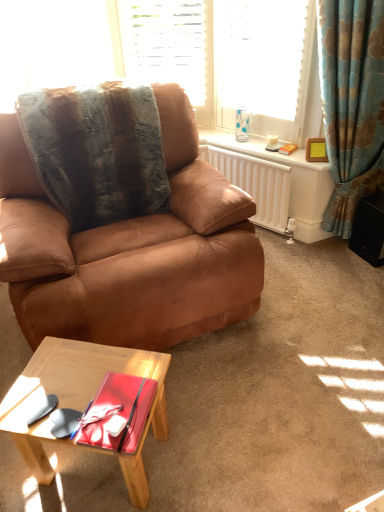
Question: Can you confirm if light wood coffee table at lower left is positioned to the right of fuzzy brown blanket at upper left?

Choices:
 (A) yes
 (B) no

Answer: (A)

Question: Considering the relative sizes of light wood coffee table at lower left and fuzzy brown blanket at upper left in the image provided, is light wood coffee table at lower left taller than fuzzy brown blanket at upper left?

Choices:
 (A) no
 (B) yes

Answer: (A)

Question: Is light wood coffee table at lower left completely or partially outside of fuzzy brown blanket at upper left?

Choices:
 (A) yes
 (B) no

Answer: (A)

Question: From a real-world perspective, is light wood coffee table at lower left located beneath fuzzy brown blanket at upper left?

Choices:
 (A) no
 (B) yes

Answer: (B)

Question: Could you tell me if light wood coffee table at lower left is turned towards fuzzy brown blanket at upper left?

Choices:
 (A) yes
 (B) no

Answer: (B)

Question: Visually, is blue floral fabric curtain at right positioned to the left or to the right of wooden picture frame at upper right?

Choices:
 (A) left
 (B) right

Answer: (B)

Question: Considering the positions of blue floral fabric curtain at right and wooden picture frame at upper right in the image, is blue floral fabric curtain at right bigger or smaller than wooden picture frame at upper right?

Choices:
 (A) small
 (B) big

Answer: (B)

Question: From the image's perspective, is blue floral fabric curtain at right above or below wooden picture frame at upper right?

Choices:
 (A) below
 (B) above

Answer: (B)

Question: Considering the positions of blue floral fabric curtain at right and wooden picture frame at upper right in the image, is blue floral fabric curtain at right taller or shorter than wooden picture frame at upper right?

Choices:
 (A) short
 (B) tall

Answer: (B)

Question: Looking at the image, does brown leather chair at center seem bigger or smaller compared to translucent glass coffee cup at upper right?

Choices:
 (A) small
 (B) big

Answer: (B)

Question: From a real-world perspective, is brown leather chair at center above or below translucent glass coffee cup at upper right?

Choices:
 (A) below
 (B) above

Answer: (A)

Question: Is brown leather chair at center in front of or behind translucent glass coffee cup at upper right in the image?

Choices:
 (A) front
 (B) behind

Answer: (A)

Question: Is brown leather chair at center spatially inside translucent glass coffee cup at upper right, or outside of it?

Choices:
 (A) inside
 (B) outside

Answer: (B)

Question: In terms of width, does brown leather chair at center look wider or thinner when compared to white textured blinds at upper center, which is the second window from right to left?

Choices:
 (A) thin
 (B) wide

Answer: (B)

Question: Is brown leather chair at center spatially inside white textured blinds at upper center, acting as the 1th window starting from the left, or outside of it?

Choices:
 (A) inside
 (B) outside

Answer: (B)